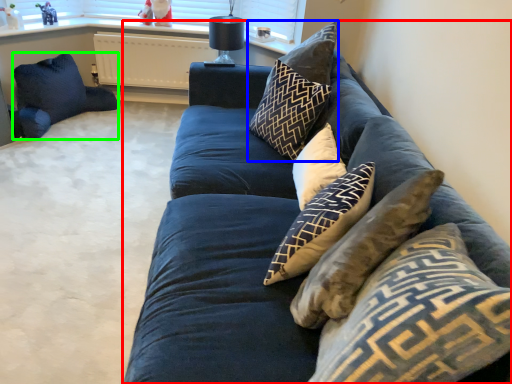
Question: Estimate the real-world distances between objects in this image. Which object is farther from studio couch (highlighted by a red box), pillow (highlighted by a blue box) or pillow (highlighted by a green box)?

Choices:
 (A) pillow
 (B) pillow

Answer: (B)